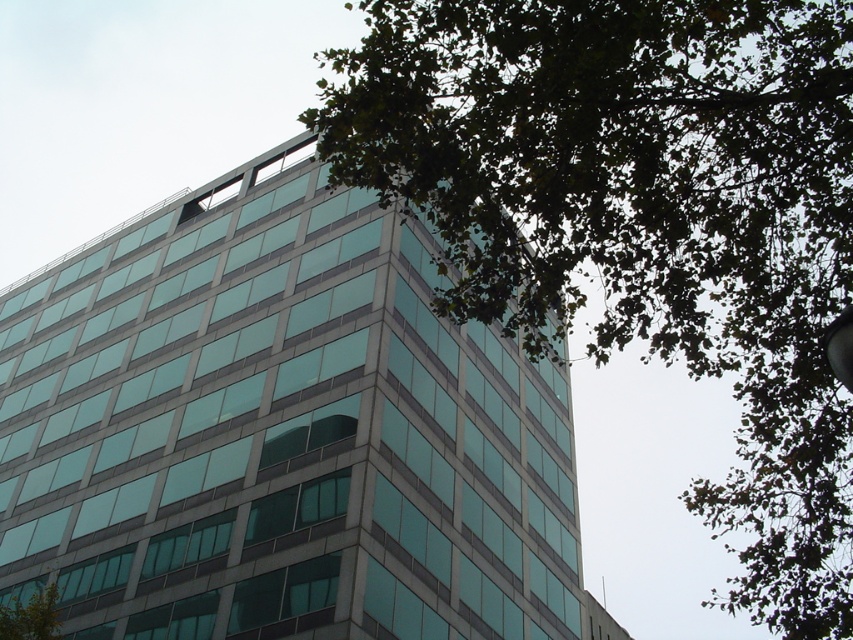
You are standing in front of the modern building and notice two points marked on the glass facade. The first point is at coordinate point(x=798, y=38) and the second is at point(x=51, y=632). Which point is nearer to your eyes?

Point(x=798, y=38) is closer to the camera than point(x=51, y=632), so the first point is nearer to your eyes.

You are standing in front of the modern building with the glass facade. There are two points marked on the building, one at coordinates point (51, 602) and another at point (851, 378). Which point is closer to you?

Point (51, 602) is further to the camera than point (851, 378), so the point closer to you is point (851, 378).

You are standing in front of the modern building and notice the green leafy tree at upper right and the metallic silver streetlight at upper right. Which object is positioned higher in the image?

The green leafy tree at upper right is located above the metallic silver streetlight at upper right, so it is positioned higher in the image.